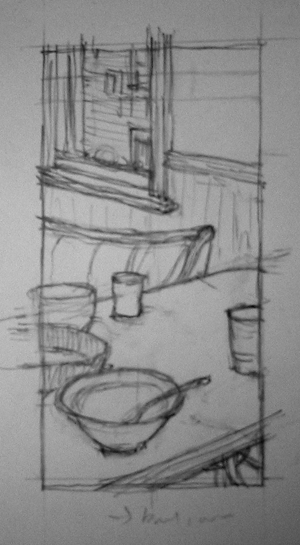
I want to click on bowl, so click(x=114, y=382), click(x=81, y=307).